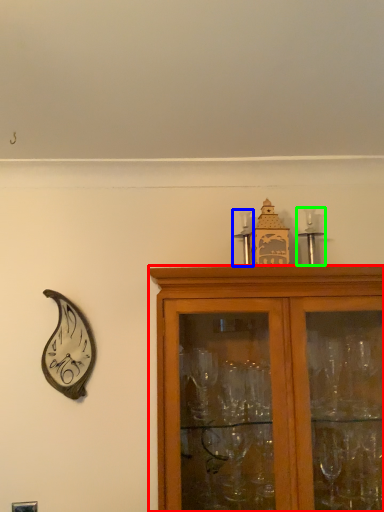
Question: Which is nearer to the cabinetry (highlighted by a red box)? candle holder (highlighted by a blue box) or candle holder (highlighted by a green box).

Choices:
 (A) candle holder
 (B) candle holder

Answer: (B)